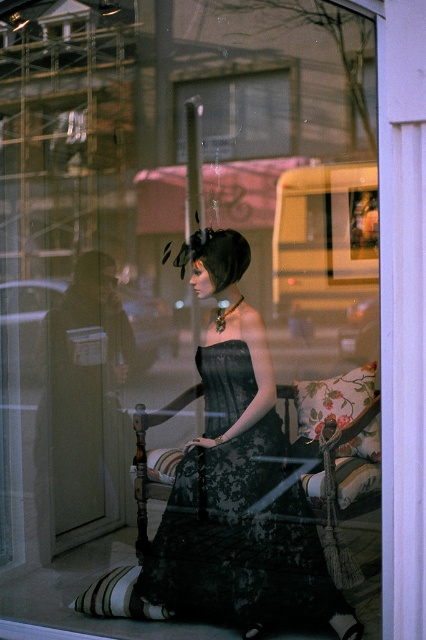
Question: Is black lace dress at center to the right of transparent glass door at center from the viewer's perspective?

Choices:
 (A) no
 (B) yes

Answer: (B)

Question: Which point appears farthest from the camera in this image?

Choices:
 (A) (190, 483)
 (B) (184, 140)

Answer: (B)

Question: Among these points, which one is nearest to the camera?

Choices:
 (A) (255, 113)
 (B) (305, 573)

Answer: (B)

Question: Does black lace dress at center appear on the left side of transparent glass door at center?

Choices:
 (A) yes
 (B) no

Answer: (B)

Question: Does black lace dress at center appear on the left side of transparent glass door at center?

Choices:
 (A) no
 (B) yes

Answer: (A)